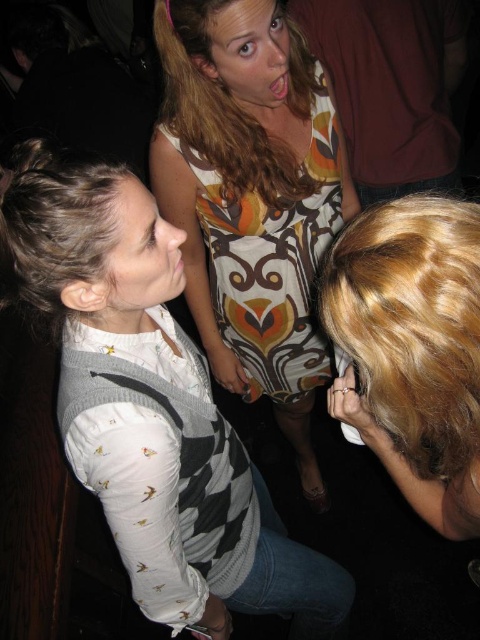
Question: Which of the following is the closest to the observer?

Choices:
 (A) white textured sweater at center
 (B) blonde wavy hair at lower right

Answer: (B)

Question: Does white textured sweater at center have a smaller size compared to blonde wavy hair at lower right?

Choices:
 (A) yes
 (B) no

Answer: (B)

Question: Which of these objects is positioned closest to the printed fabric dress at center?

Choices:
 (A) dark brown textured hair at left
 (B) blonde wavy hair at upper center

Answer: (B)

Question: Can you confirm if printed fabric dress at center is positioned below blonde wavy hair at upper center?

Choices:
 (A) yes
 (B) no

Answer: (A)

Question: Considering the real-world distances, which object is farthest from the printed fabric dress at center?

Choices:
 (A) dark brown textured hair at left
 (B) white textured sweater at center
 (C) blonde wavy hair at lower right

Answer: (C)

Question: Is blonde wavy hair at lower right smaller than blonde wavy hair at upper center?

Choices:
 (A) no
 (B) yes

Answer: (B)